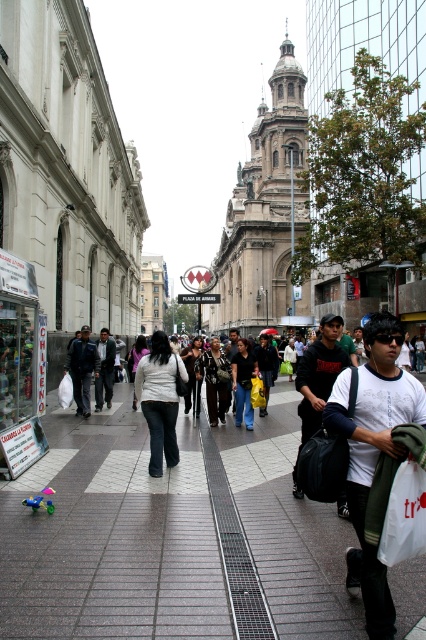
Question: Considering the real-world distances, which object is closest to the dark gray pants at left?

Choices:
 (A) white cotton shirt at center
 (B) dark gray jacket at center

Answer: (B)

Question: Can you confirm if white plastic bag at lower right is positioned to the right of dark gray pants at left?

Choices:
 (A) yes
 (B) no

Answer: (A)

Question: Estimate the real-world distances between objects in this image. Which object is farther from the dark gray pants at left?

Choices:
 (A) dark gray jacket at center
 (B) gray concrete sidewalk at center
 (C) dark gray jeans at center

Answer: (B)

Question: Among these objects, which one is farthest from the camera?

Choices:
 (A) white cotton shirt at center
 (B) white plastic bag at lower right
 (C) dark gray jacket at center
 (D) gray concrete sidewalk at center

Answer: (C)

Question: Does dark gray jeans at center appear on the left side of dark gray jacket at center?

Choices:
 (A) no
 (B) yes

Answer: (A)

Question: Is dark gray pants at left to the left of dark gray jacket at center from the viewer's perspective?

Choices:
 (A) yes
 (B) no

Answer: (A)